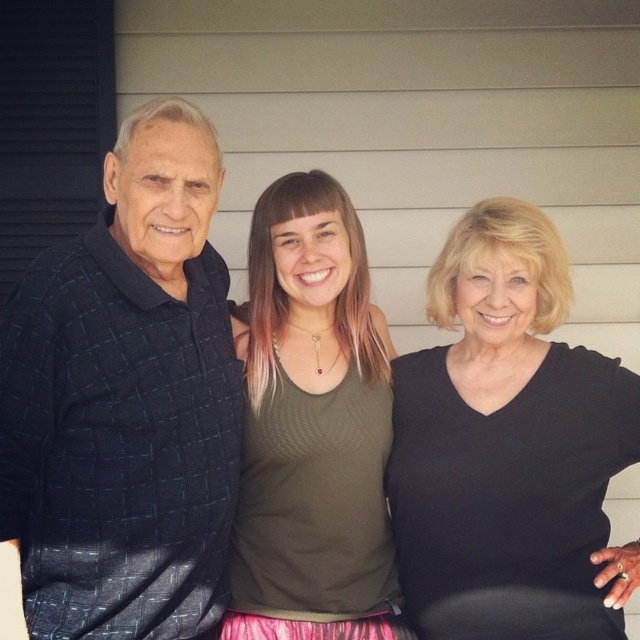
Based on the scene description, which person is wearing the dark blue textured polo shirt at left and where is their position relative to the black matte shirt at right?

The dark blue textured polo shirt at left is worn by the older man on the left side of the image. It is positioned above the black matte shirt at right, which belongs to the older woman on the right.

Based on the scene description, where is the black matte shirt at right located in terms of its position relative to the other people in the image?

The black matte shirt at right is located at the rightmost position among the three individuals, as it is described as being at the right side of the image.

You are taking a photo of three people standing against a house wall. You notice two points marked as point 1 at coordinates (506, 384) and point 2 at coordinates (308, 362). Which point is closer to the camera?

Point 1 at coordinates (506, 384) is closer to the camera than point 2 at coordinates (308, 362).